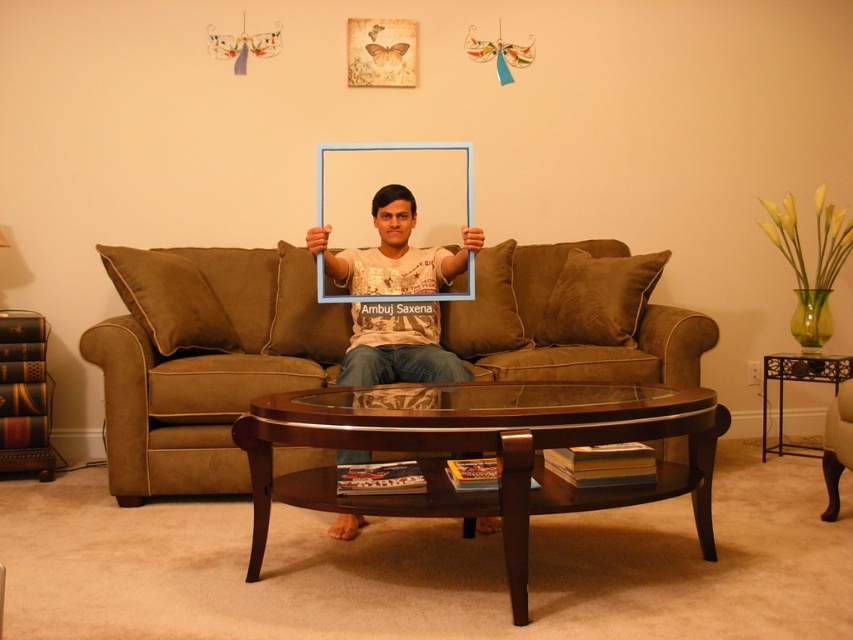
You are trying to place a new rectangular side table between the brown suede couch at center and the blue plastic picture frame at center. The side table is 1.2 meters wide. Can you fit it there?

The brown suede couch at center might be wider than the blue plastic picture frame at center, but without knowing the exact width of the couch, it is uncertain if the 1.2 meter side table will fit between them.